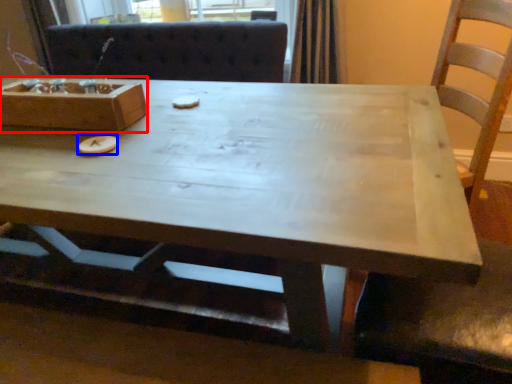
Question: Which of the following is the farthest to the observer, box (highlighted by a red box) or food (highlighted by a blue box)?

Choices:
 (A) box
 (B) food

Answer: (A)